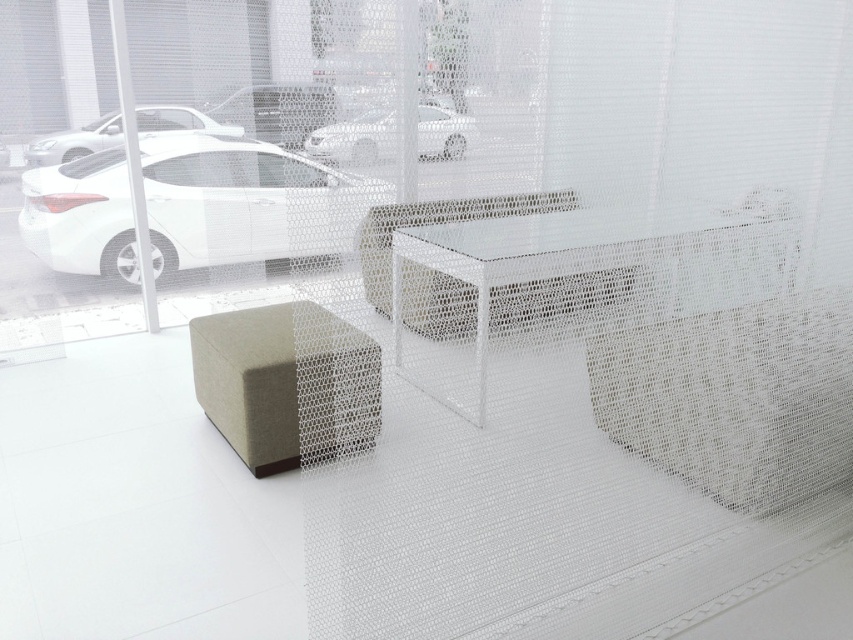
Is white matte car at left below metallic silver car at upper center?

Indeed, white matte car at left is positioned under metallic silver car at upper center.

Is point (161, 241) positioned before point (265, 120)?

No.

Does point (316, 246) come farther from viewer compared to point (270, 100)?

No, it is not.

The width and height of the screenshot is (853, 640). I want to click on white matte car at left, so pos(247,202).

Does metallic silver car at upper center have a greater height compared to white glossy car at upper left?

In fact, metallic silver car at upper center may be shorter than white glossy car at upper left.

In the scene shown: Does metallic silver car at upper center come in front of white glossy car at upper left?

No, it is behind white glossy car at upper left.

Locate an element on the screen. The height and width of the screenshot is (640, 853). metallic silver car at upper center is located at coordinates (277, 109).

Is point (212, 232) positioned before point (82, 152)?

No.

Can you confirm if white matte car at left is taller than white glossy car at upper left?

Correct, white matte car at left is much taller as white glossy car at upper left.

Find the location of a particular element. white matte car at left is located at coordinates (247, 202).